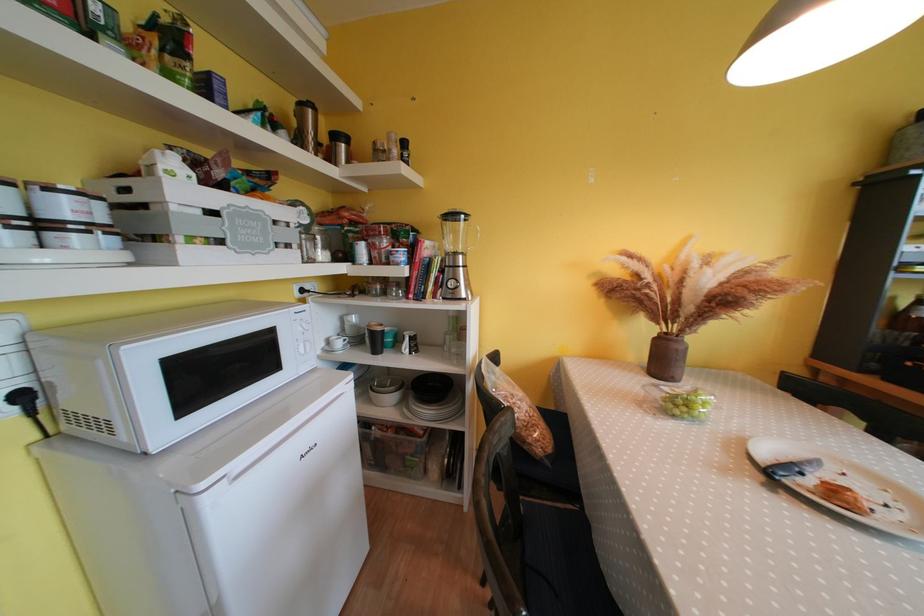
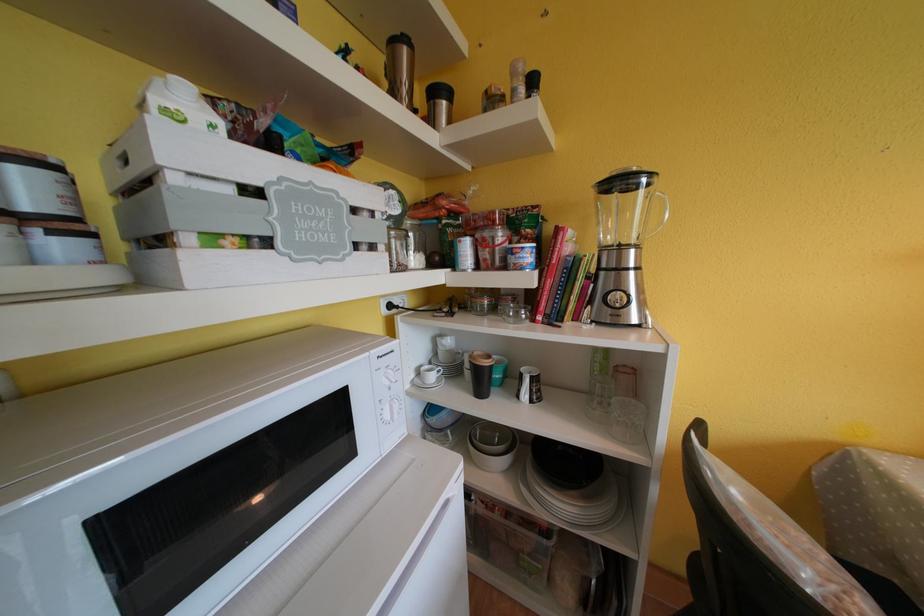
The point at [378,328] is marked in the first image. Where is the corresponding point in the second image?

(481, 358)